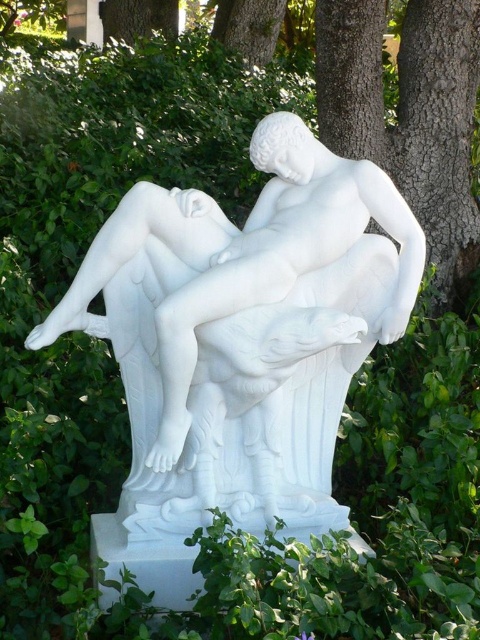
You are an art student analyzing the composition of the sculpture and its surroundings. Which object, the white marble statue at center or the brown rough tree trunk at upper center, is positioned closer to the viewer?

The white marble statue at center is positioned closer to the viewer than the brown rough tree trunk at upper center.

You are a painter setting up an easel to sketch the white marble statue at center and the brown rough tree trunk at upper center. You want to ensure that your painting accurately represents their relative positions. Based on the scene description, can you determine which object is closer to you?

The white marble statue at center is closer to you than the brown rough tree trunk at upper center because the distance between them is 34.92 inches, meaning the statue is nearer in the foreground while the tree trunk is further back in the background.

Based on the scene description, which object is larger in size between the white marble statue at center and the brown rough tree trunk at upper center?

The white marble statue at center is bigger than the brown rough tree trunk at upper center according to the description.